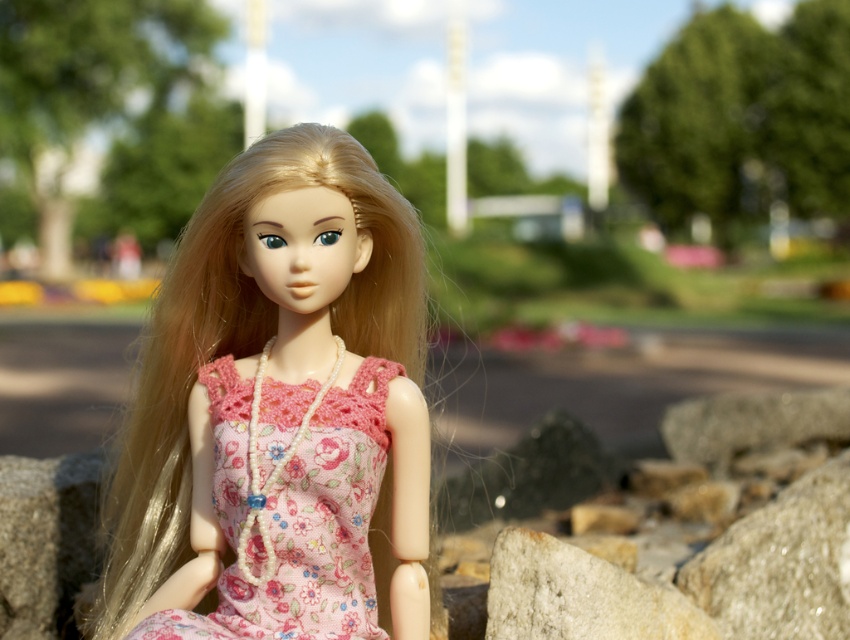
Question: Is floral fabric dress at center wider than gray granite stone at lower left?

Choices:
 (A) yes
 (B) no

Answer: (A)

Question: Is floral fabric dress at center wider than gray granite stone at lower left?

Choices:
 (A) no
 (B) yes

Answer: (B)

Question: Among these objects, which one is nearest to the camera?

Choices:
 (A) pink fabric dress at center
 (B) floral fabric dress at center
 (C) gray rough stone at lower right
 (D) gray rough stone at center

Answer: (B)

Question: Is floral fabric dress at center below gray granite stone at lower left?

Choices:
 (A) yes
 (B) no

Answer: (B)

Question: Which object is the closest to the gray rough stone at center?

Choices:
 (A) floral fabric dress at center
 (B) gray rough stone at lower right
 (C) gray granite stone at lower left

Answer: (B)

Question: Which object is closer to the camera taking this photo?

Choices:
 (A) gray rough stone at center
 (B) pink fabric dress at center
 (C) floral fabric dress at center
 (D) gray granite stone at lower left

Answer: (C)